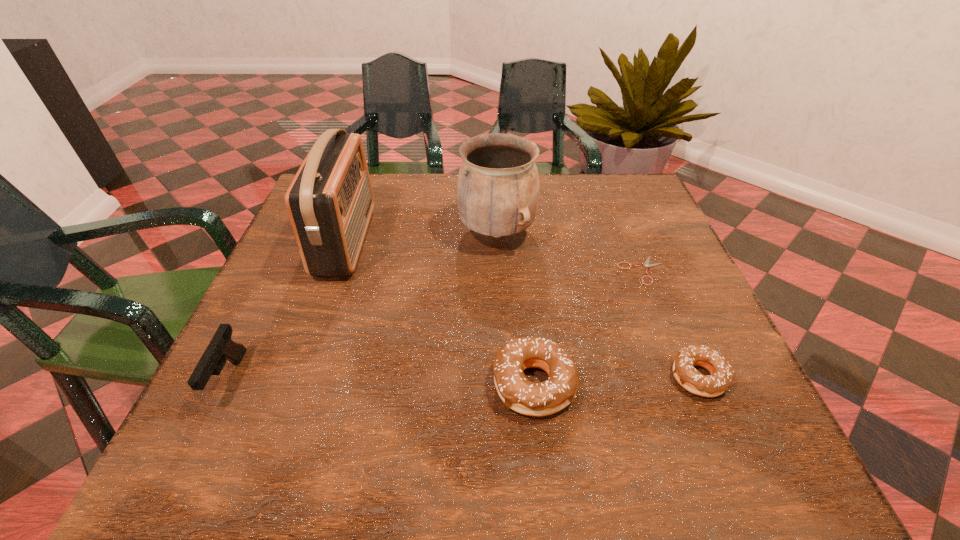
I want to click on free region that satisfies the following two spatial constraints: 1. on the front-facing side of the fifth object from right to left; 2. on the back side of the fifth tallest object, so click(299, 376).

I want to click on vacant space that satisfies the following two spatial constraints: 1. on the back side of the shortest object; 2. on the front-facing side of the radio receiver, so click(x=630, y=241).

Where is `free space that satisfies the following two spatial constraints: 1. on the front-facing side of the radio receiver; 2. on the back side of the shorter doughnut`? free space that satisfies the following two spatial constraints: 1. on the front-facing side of the radio receiver; 2. on the back side of the shorter doughnut is located at coordinates (299, 376).

I want to click on free spot that satisfies the following two spatial constraints: 1. on the front-facing side of the shortest object; 2. on the right side of the radio receiver, so click(x=336, y=271).